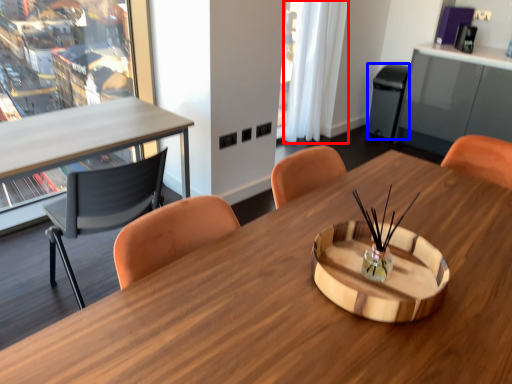
Question: Among these objects, which one is farthest to the camera, curtain (highlighted by a red box) or trash bin/can (highlighted by a blue box)?

Choices:
 (A) curtain
 (B) trash bin/can

Answer: (B)